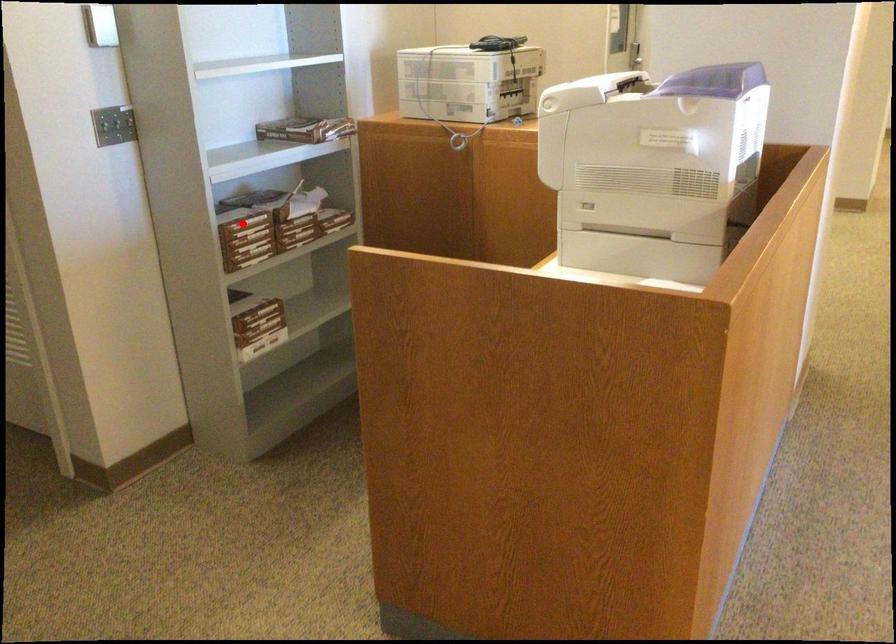
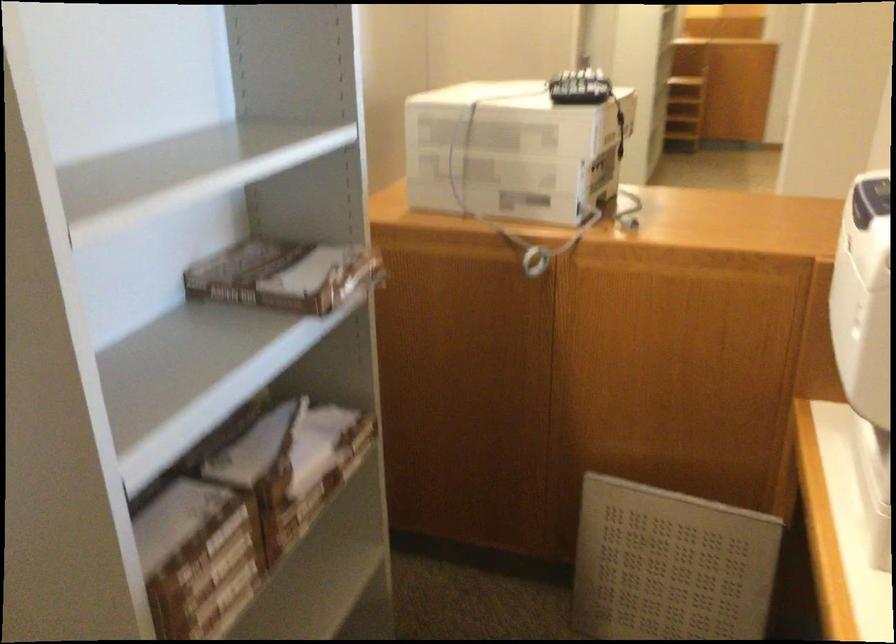
Question: I am providing you with two images of the same scene from different viewpoints. Image1 has a red point marked. In image2, the corresponding 3D location appears at what relative position? Reply with the corresponding letter.

Choices:
 (A) Closer
 (B) Farther

Answer: (A)